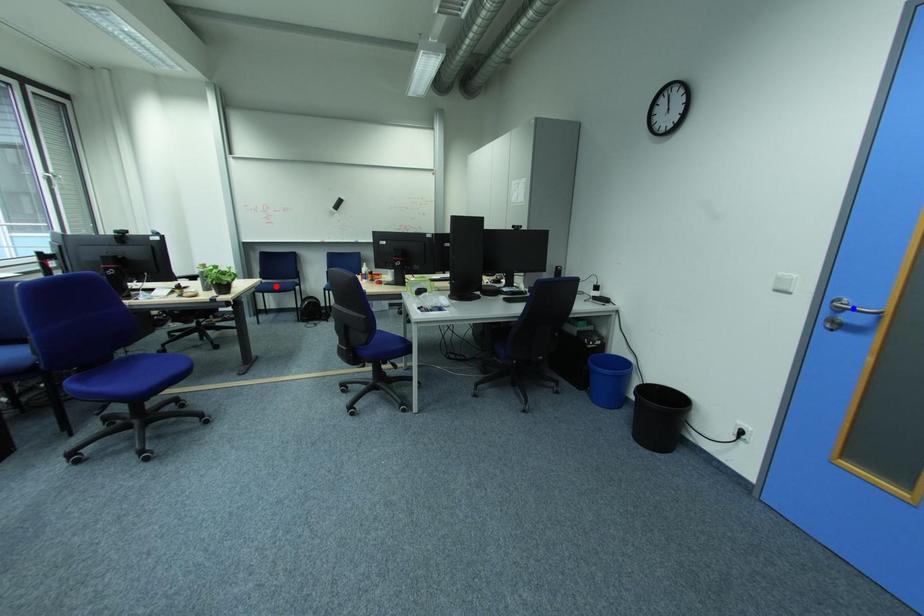
Question: Which of the two points in the image is closer to the camera?

Choices:
 (A) Blue point is closer.
 (B) Red point is closer.

Answer: (A)